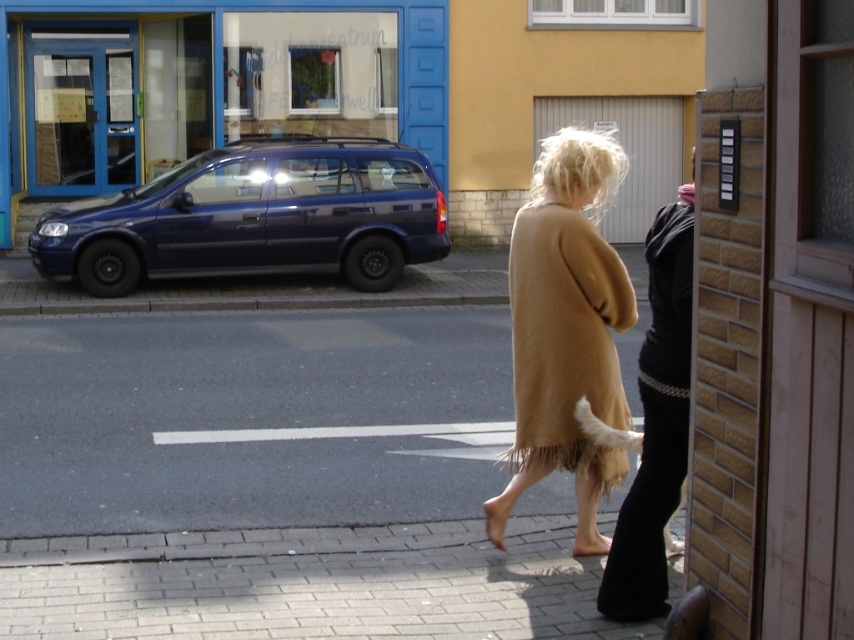
You are a delivery driver who needs to park a truck that is 10 feet long in the parking spot where the blue metallic car at left and glossy blue minivan at left are currently parked. Based on their sizes, can you fit your truck into the parking spot?

The blue metallic car at left is larger than the glossy blue minivan at left. Since the truck is 10 feet long, it might fit if the parking spot is sized for vehicles larger than the minivan, but the exact fit depends on the spot size. However, the description only mentions the relative sizes of the cars, not the parking spot dimensions.

You are standing at the point marked by the coordinate point (x=250, y=419). Looking around, you see the beige coat with fringe details at the bottom and the dark clothing individual. Which direction should you walk to reach the blue vehicle parked along the curb?

The smooth concrete pavement at lower center is represented by point (x=250, y=419). Since the blue vehicle is parked along the curb in the background, you should walk forward from the point to reach it.

You are standing on the sidewalk and want to cross the street to reach the blue metallic car at left. The crosswalk is 16 meters away. Can you safely reach the car before the crosswalk ends?

Result: The blue metallic car at left is 15.84 meters away from you, which is less than the 16 meters distance to the crosswalk. Therefore, you can safely reach the car before the crosswalk ends.